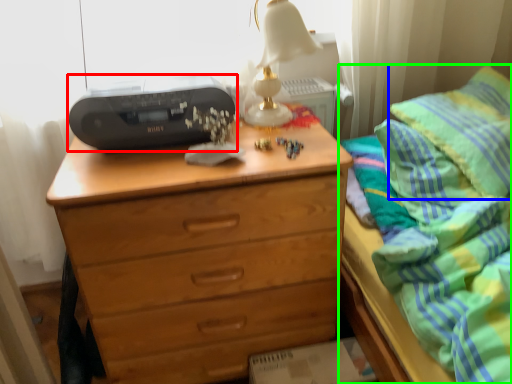
Question: Which object is the closest to the printer (highlighted by a red box)? Choose among these: pillow (highlighted by a blue box) or bed (highlighted by a green box).

Choices:
 (A) pillow
 (B) bed

Answer: (B)